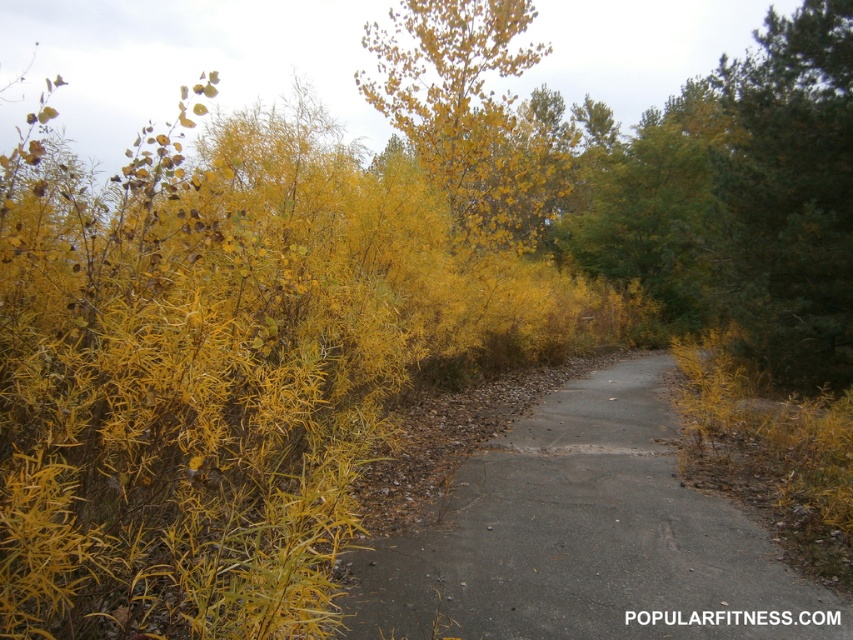
You are standing on the gray asphalt trail at center and looking towards the yellow leafy tree at upper center. Which object is taller?

The yellow leafy tree at upper center is taller than the gray asphalt trail at center.

You are an artist planning to paint this autumn scene. You want to ensure the gray asphalt trail at center and the yellow leafy tree at upper center are proportionally accurate. Which object should you make smaller in your painting?

The gray asphalt trail at center should be made smaller because it occupies less space than the yellow leafy tree at upper center in the image.